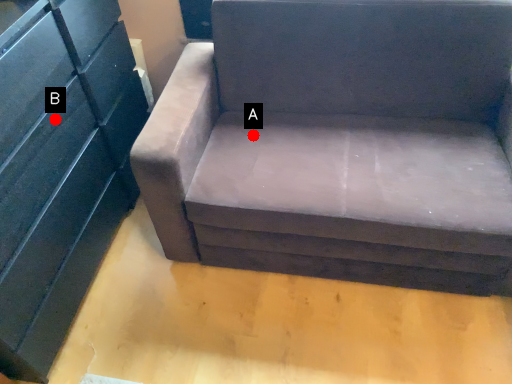
Question: Two points are circled on the image, labeled by A and B beside each circle. Which point is closer to the camera?

Choices:
 (A) A is closer
 (B) B is closer

Answer: (B)